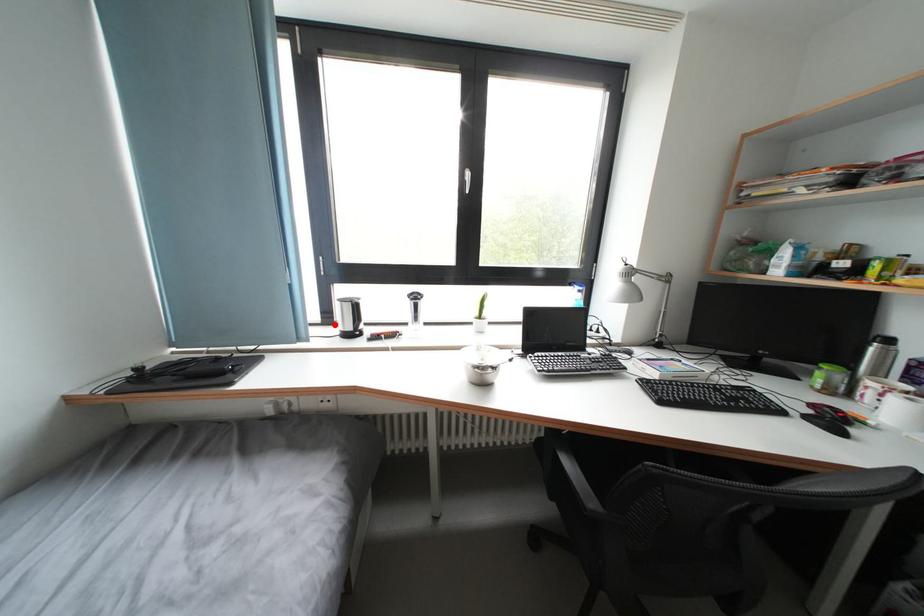
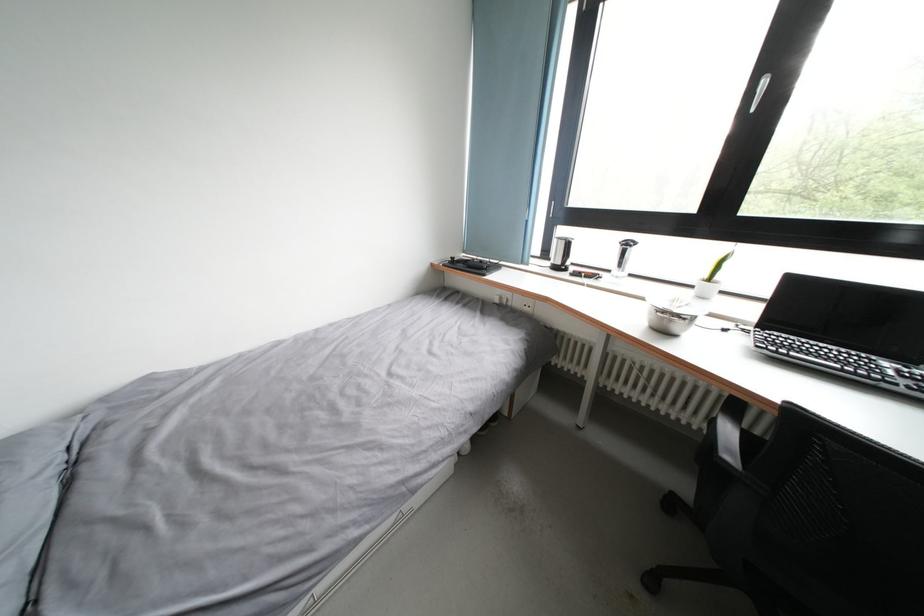
Question: A red point is marked in image1. In image2, is the corresponding 3D point closer to the camera or farther? Reply with the corresponding letter.

Choices:
 (A) The corresponding 3D point is closer.
 (B) The corresponding 3D point is farther.

Answer: (A)